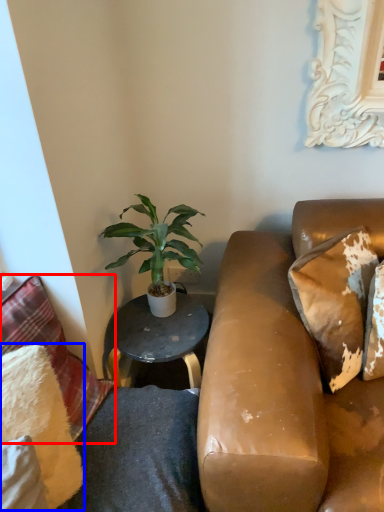
Question: Which object is further to the camera taking this photo, pillow (highlighted by a red box) or pillow (highlighted by a blue box)?

Choices:
 (A) pillow
 (B) pillow

Answer: (A)